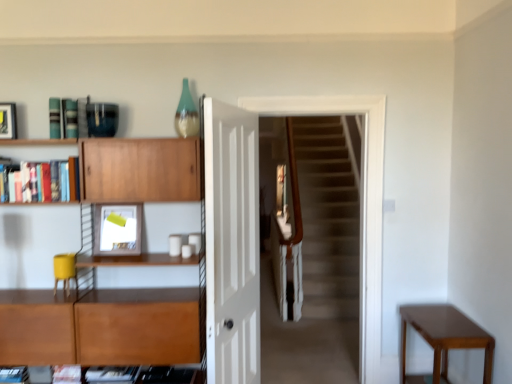
Question: Considering the relative sizes of wooden bookshelf at upper left, which is the 1th shelf in top-to-bottom order, and wooden cabinet at left, the first shelf ordered from the bottom, in the image provided, is wooden bookshelf at upper left, which is the 1th shelf in top-to-bottom order, thinner than wooden cabinet at left, the first shelf ordered from the bottom,?

Choices:
 (A) yes
 (B) no

Answer: (A)

Question: From the image's perspective, is wooden bookshelf at upper left, which is the 1th shelf in top-to-bottom order, located above wooden cabinet at left, which is the second shelf in top-to-bottom order?

Choices:
 (A) yes
 (B) no

Answer: (A)

Question: Can you confirm if wooden bookshelf at upper left, the 2th shelf positioned from the bottom, is positioned to the left of wooden cabinet at left, which is the second shelf in top-to-bottom order?

Choices:
 (A) yes
 (B) no

Answer: (A)

Question: Is wooden bookshelf at upper left, which is the 1th shelf in top-to-bottom order, looking in the opposite direction of wooden cabinet at left, which is the second shelf in top-to-bottom order?

Choices:
 (A) yes
 (B) no

Answer: (A)

Question: Does wooden bookshelf at upper left, the 2th shelf positioned from the bottom, have a lesser height compared to wooden cabinet at left, which is the second shelf in top-to-bottom order?

Choices:
 (A) no
 (B) yes

Answer: (B)

Question: Looking at the image, does wooden cabinet at left, which is the second shelf in top-to-bottom order, seem bigger or smaller compared to wooden bookshelf at upper left, the 2th shelf positioned from the bottom?

Choices:
 (A) small
 (B) big

Answer: (B)

Question: Is wooden cabinet at left, which is the second shelf in top-to-bottom order, taller or shorter than wooden bookshelf at upper left, which is the 1th shelf in top-to-bottom order?

Choices:
 (A) tall
 (B) short

Answer: (A)

Question: Is wooden cabinet at left, the first shelf ordered from the bottom, in front of or behind wooden bookshelf at upper left, which is the 1th shelf in top-to-bottom order, in the image?

Choices:
 (A) behind
 (B) front

Answer: (B)

Question: Does point (190, 165) appear closer or farther from the camera than point (53, 200)?

Choices:
 (A) farther
 (B) closer

Answer: (A)

Question: From a real-world perspective, is mahogany wood table at lower right above or below matte white picture frame at upper left, marked as the first picture frame in a top-to-bottom arrangement?

Choices:
 (A) below
 (B) above

Answer: (A)

Question: Considering the positions of point (483, 359) and point (11, 119), is point (483, 359) closer or farther from the camera than point (11, 119)?

Choices:
 (A) farther
 (B) closer

Answer: (B)

Question: Is mahogany wood table at lower right taller or shorter than matte white picture frame at upper left, the 2th picture frame ordered from the bottom?

Choices:
 (A) short
 (B) tall

Answer: (B)

Question: Looking at their shapes, would you say mahogany wood table at lower right is wider or thinner than matte white picture frame at upper left, which appears as the 1th picture frame when viewed from the left?

Choices:
 (A) wide
 (B) thin

Answer: (A)

Question: From the image's perspective, is mahogany wood table at lower right positioned above or below wooden cabinet at left, the first shelf ordered from the bottom?

Choices:
 (A) below
 (B) above

Answer: (A)

Question: In terms of height, does mahogany wood table at lower right look taller or shorter compared to wooden cabinet at left, the first shelf ordered from the bottom?

Choices:
 (A) short
 (B) tall

Answer: (A)